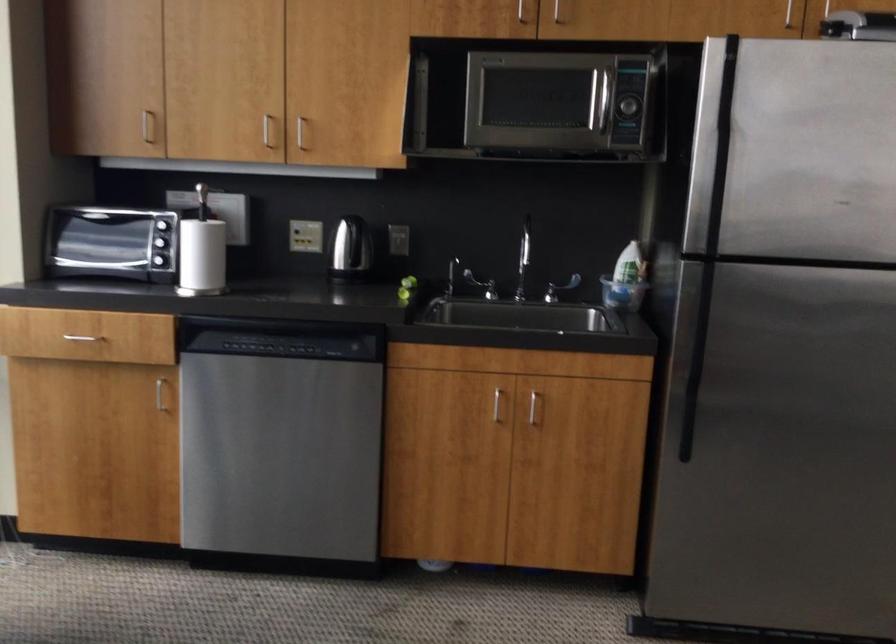
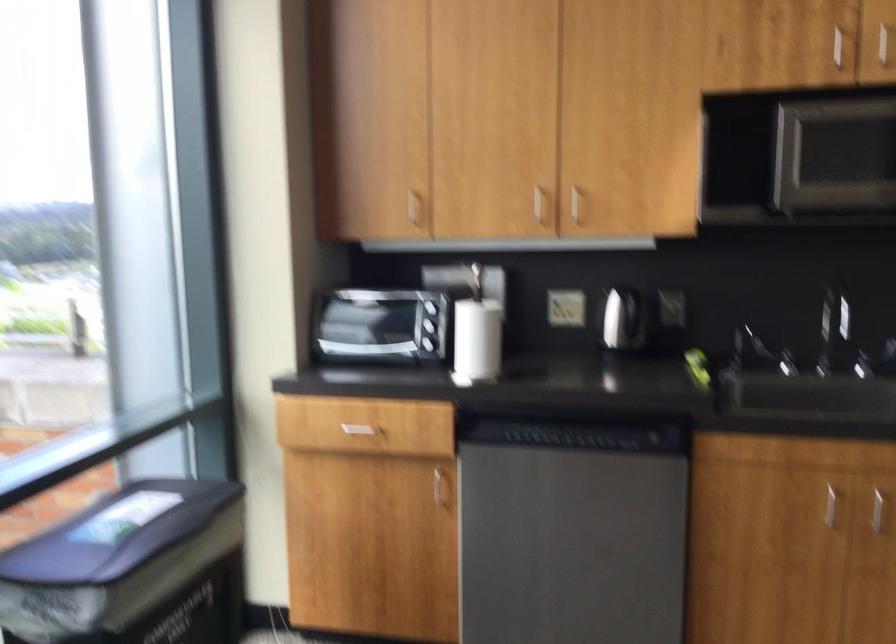
Question: How did the camera likely rotate?

Choices:
 (A) Left
 (B) Right
 (C) Up
 (D) Down

Answer: (A)